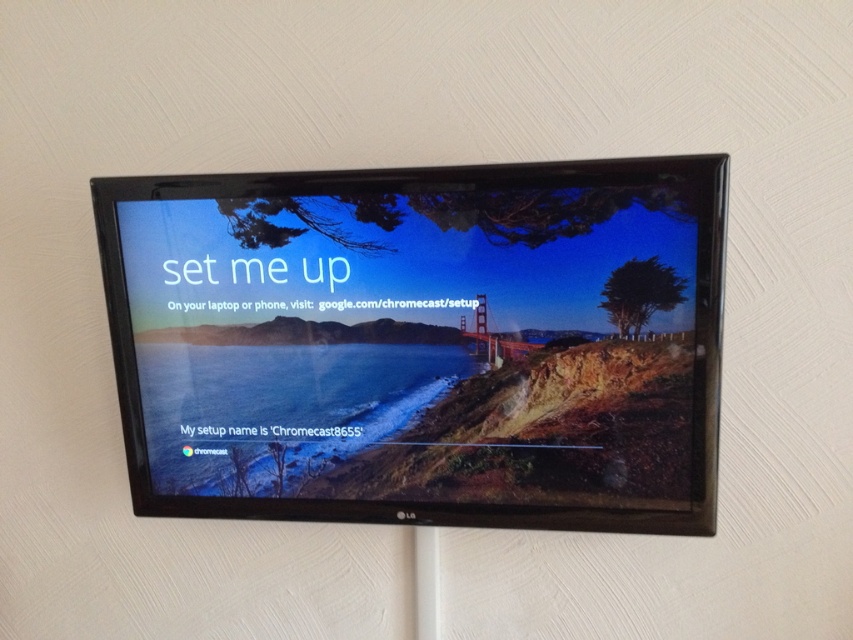
Question: Among these points, which one is farthest from the camera?

Choices:
 (A) (477, 300)
 (B) (679, 508)

Answer: (B)

Question: Considering the relative positions of matte black tv at center and metallic bridge at center in the image provided, where is matte black tv at center located with respect to metallic bridge at center?

Choices:
 (A) left
 (B) right

Answer: (A)

Question: Does matte black tv at center have a greater width compared to metallic bridge at center?

Choices:
 (A) yes
 (B) no

Answer: (A)

Question: Does matte black tv at center have a smaller size compared to metallic bridge at center?

Choices:
 (A) no
 (B) yes

Answer: (A)

Question: Which of the following is the farthest from the observer?

Choices:
 (A) (463, 330)
 (B) (233, 502)

Answer: (B)